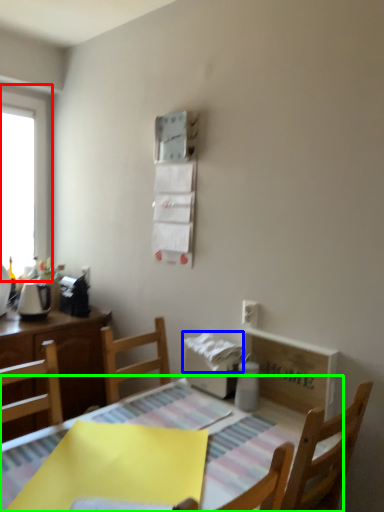
Question: Which is farther away from window (highlighted by a red box)? toilet paper (highlighted by a blue box) or table (highlighted by a green box)?

Choices:
 (A) toilet paper
 (B) table

Answer: (B)